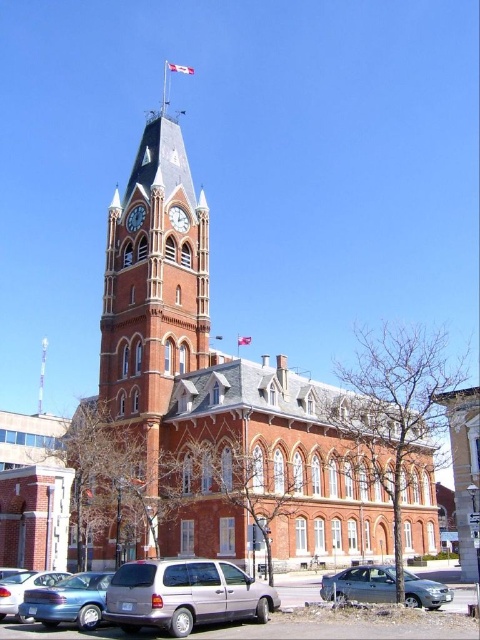
You are standing in front of the historic building and notice two points marked on the facade. The first point is at coordinates point (220, 611) and the second is at point (251, 339). Which of these points is closer to you?

Point (220, 611) is in front of point (251, 339), so it is closer to you.

You are driving a car and want to park near the historic building. The parking lot is located behind the red fabric flag at upper center. Can you see the parking lot from your current position near the matte blue sedan at lower left?

The matte blue sedan at lower left is in front of the red fabric flag at upper center, so the parking lot behind the red fabric flag at upper center is not visible from the current position near the matte blue sedan at lower left.

What are the coordinates of the brick clock tower at center?

The brick clock tower at center is located at point (154,292).